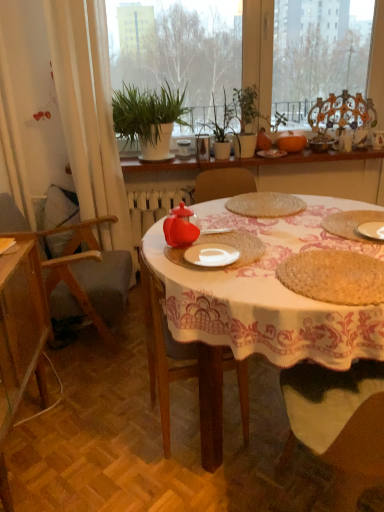
Identify the location of vacant area located to the right-hand side of white ceramic plate at center. (269, 256).